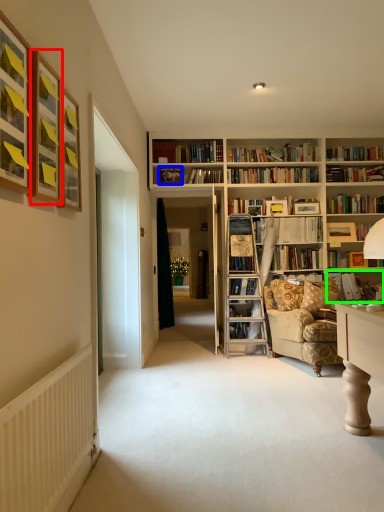
Question: Considering the real-world distances, which object is closest to picture frame (highlighted by a red box)? picture frame (highlighted by a blue box) or book (highlighted by a green box).

Choices:
 (A) picture frame
 (B) book

Answer: (A)